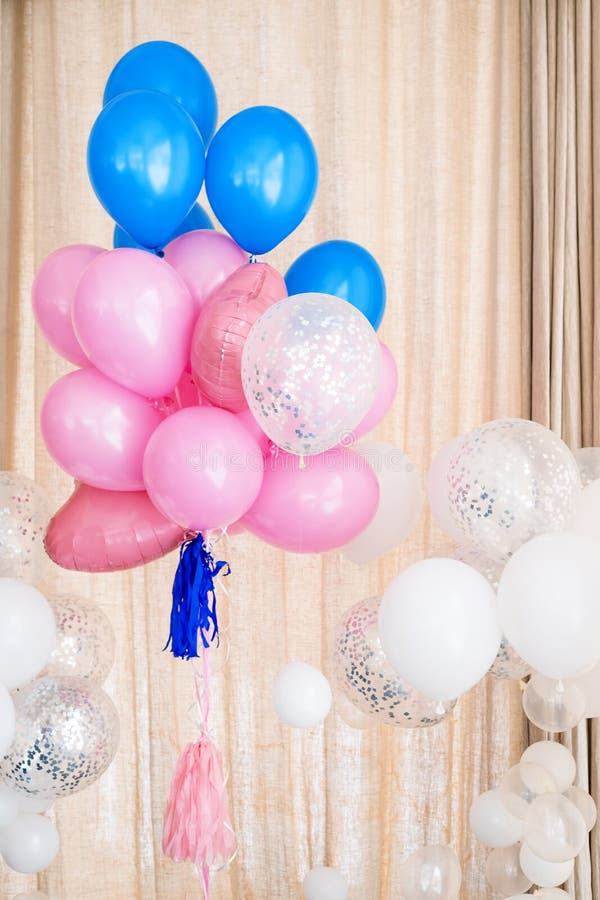
You are a GUI agent. You are given a task and a screenshot of the screen. Output one action in this format:
    pyautogui.click(x=<x>, y=<y>)
    Task: Click on the pink tassel
    The height and width of the screenshot is (900, 600).
    Given the screenshot: What is the action you would take?
    pyautogui.click(x=183, y=802)